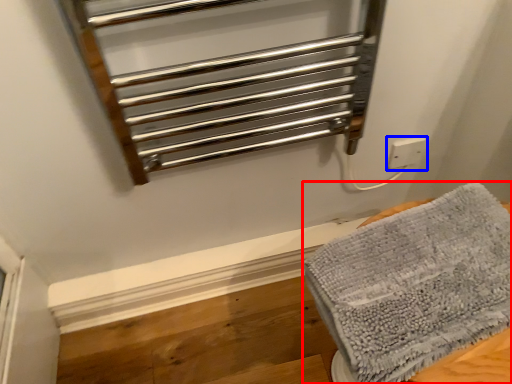
Question: Which object is closer to the camera taking this photo, towel (highlighted by a red box) or electric outlet (highlighted by a blue box)?

Choices:
 (A) towel
 (B) electric outlet

Answer: (A)